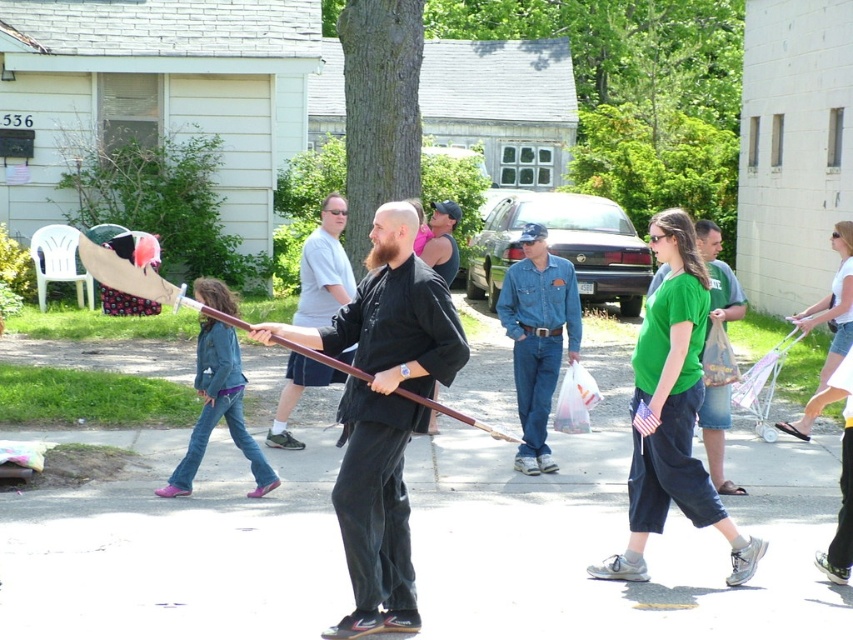
Question: Which point is closer to the camera?

Choices:
 (A) matte black shirt at center
 (B) green matte shirt at center

Answer: (B)

Question: Which point appears closest to the camera in this image?

Choices:
 (A) (322, 310)
 (B) (712, 260)
 (C) (368, 448)

Answer: (C)

Question: Which point appears closest to the camera in this image?

Choices:
 (A) (329, 202)
 (B) (711, 394)

Answer: (B)

Question: Does black matte sword at center have a larger size compared to matte black shirt at center?

Choices:
 (A) yes
 (B) no

Answer: (A)

Question: Is matte black shirt at center positioned before green matte shirt at center?

Choices:
 (A) no
 (B) yes

Answer: (A)

Question: Is black matte sword at center above matte black shirt at center?

Choices:
 (A) no
 (B) yes

Answer: (A)